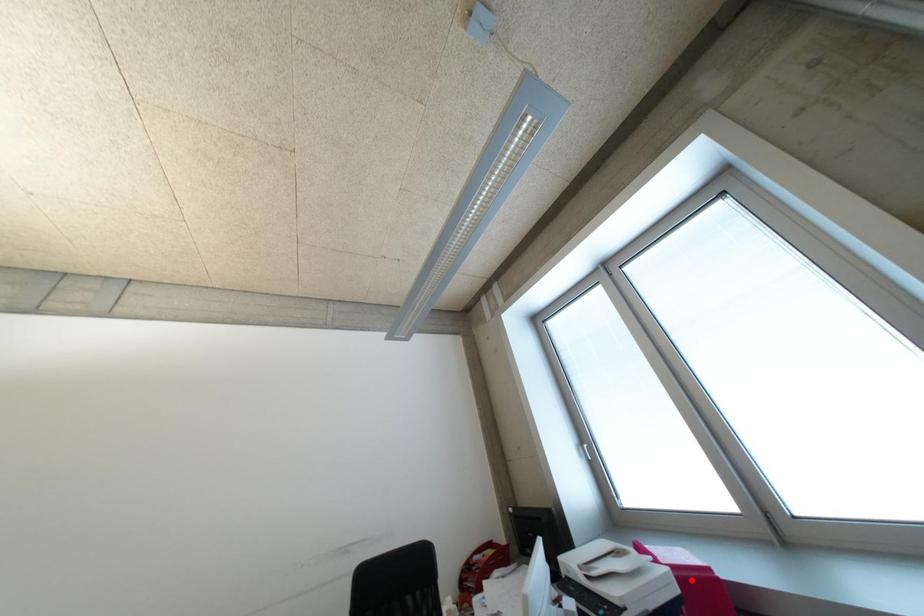
Question: In the image, two points are highlighted. Which point is nearer to the camera? Reply with the corresponding letter.

Choices:
 (A) blue point
 (B) red point

Answer: (A)